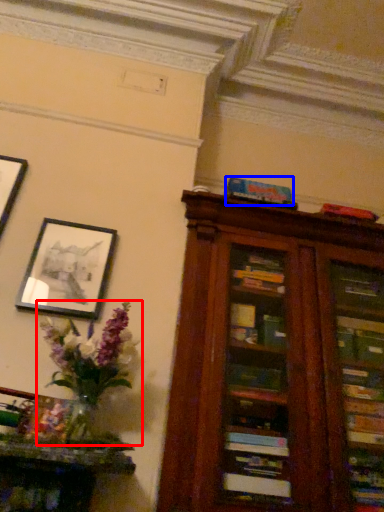
Question: Which of the following is the farthest to the observer, floral arrangement (highlighted by a red box) or paperback book (highlighted by a blue box)?

Choices:
 (A) floral arrangement
 (B) paperback book

Answer: (B)